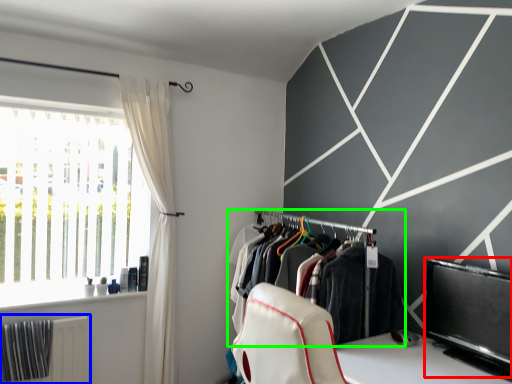
Question: Considering the real-world distances, which object is closest to window screen (highlighted by a red box)? radiator (highlighted by a blue box) or closet (highlighted by a green box).

Choices:
 (A) radiator
 (B) closet

Answer: (B)